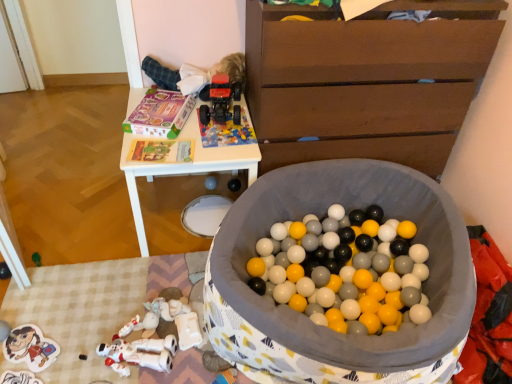
Image resolution: width=512 pixels, height=384 pixels. What do you see at coordinates (326, 327) in the screenshot?
I see `soft fabric ball pit at center, which is the sixth toy in left-to-right order` at bounding box center [326, 327].

At what (x,y) coordinates should I click in order to perform the action: click on white matte plastic robot at lower left, which is the 2th toy from left to right. Please return your answer as a coordinate pair (x, y). This screenshot has height=384, width=512. Looking at the image, I should click on (150, 338).

The width and height of the screenshot is (512, 384). I want to click on matte plastic speaker at center, positioned as the fourth toy in right-to-left order, so click(210, 183).

Measure the distance between point [42,338] and camera.

The distance of point [42,338] from camera is 1.48 meters.

What do you see at coordinates (185, 167) in the screenshot? The height and width of the screenshot is (384, 512). I see `white plastic table at upper center` at bounding box center [185, 167].

This screenshot has width=512, height=384. Describe the element at coordinates (161, 74) in the screenshot. I see `fluffy white baby at upper center` at that location.

Locate an element on the screen. This screenshot has width=512, height=384. soft fabric ball pit at center, acting as the first toy starting from the right is located at coordinates (326, 327).

Is soft fabric ball pit at center, which is the sixth toy in left-to-right order, oriented towards rubberized red toy truck at upper center, which appears as the third toy when viewed from the right?

No, soft fabric ball pit at center, which is the sixth toy in left-to-right order, is not oriented towards rubberized red toy truck at upper center, which appears as the third toy when viewed from the right.

Which is correct: soft fabric ball pit at center, which is the sixth toy in left-to-right order, is inside rubberized red toy truck at upper center, which appears as the third toy when viewed from the right, or outside of it?

The correct answer is: outside.

Is soft fabric ball pit at center, acting as the first toy starting from the right, shorter than rubberized red toy truck at upper center, which is the 4th toy from left to right?

No, soft fabric ball pit at center, acting as the first toy starting from the right, is not shorter than rubberized red toy truck at upper center, which is the 4th toy from left to right.

Is soft fabric ball pit at center, which is the sixth toy in left-to-right order, behind fluffy white baby at upper center?

No.

At what (x,y) coordinates should I click in order to perform the action: click on baby behind the soft fabric ball pit at center, acting as the first toy starting from the right. Please return your answer as a coordinate pair (x, y). The image size is (512, 384). Looking at the image, I should click on (161, 74).

Which of these two, soft fabric ball pit at center, which is the sixth toy in left-to-right order, or fluffy white baby at upper center, is bigger?

Bigger between the two is soft fabric ball pit at center, which is the sixth toy in left-to-right order.

Could you measure the distance between soft fabric ball pit at center, acting as the first toy starting from the right, and fluffy white baby at upper center?

soft fabric ball pit at center, acting as the first toy starting from the right, and fluffy white baby at upper center are 85.79 centimeters apart from each other.

Between brown wooden chest of drawers at upper right and soft fabric ball pit at center, which is the sixth toy in left-to-right order, which one has smaller size?

With smaller size is soft fabric ball pit at center, which is the sixth toy in left-to-right order.

Is point (336, 83) farther from camera compared to point (286, 185)?

No, (336, 83) is closer to viewer.

Is brown wooden chest of drawers at upper right to the left or to the right of soft fabric ball pit at center, which is the sixth toy in left-to-right order, in the image?

In the image, brown wooden chest of drawers at upper right appears on the right side of soft fabric ball pit at center, which is the sixth toy in left-to-right order.

Locate an element on the screen. The image size is (512, 384). chest of drawers above the soft fabric ball pit at center, acting as the first toy starting from the right (from the image's perspective) is located at coordinates (x=365, y=82).

Is matte black speaker at center, the second toy in the right-to-left sequence, facing away from fluffy white baby at upper center?

matte black speaker at center, the second toy in the right-to-left sequence, is not turned away from fluffy white baby at upper center.

From a real-world perspective, is matte black speaker at center, acting as the 5th toy starting from the left, positioned above or below fluffy white baby at upper center?

matte black speaker at center, acting as the 5th toy starting from the left, is situated lower than fluffy white baby at upper center in the real world.

In the scene shown: Considering the relative sizes of matte black speaker at center, the second toy in the right-to-left sequence, and fluffy white baby at upper center in the image provided, is matte black speaker at center, the second toy in the right-to-left sequence, thinner than fluffy white baby at upper center?

Correct, the width of matte black speaker at center, the second toy in the right-to-left sequence, is less than that of fluffy white baby at upper center.

Which point is more forward, (228, 182) or (223, 61)?

The point (223, 61) is closer to the camera.

Is soft fabric ball pit at center, acting as the first toy starting from the right, surrounded by rubberized red toy truck at upper center, which appears as the third toy when viewed from the right?

No, soft fabric ball pit at center, acting as the first toy starting from the right, is not a part of rubberized red toy truck at upper center, which appears as the third toy when viewed from the right.

Is rubberized red toy truck at upper center, which is the 4th toy from left to right, closer to the viewer compared to soft fabric ball pit at center, which is the sixth toy in left-to-right order?

No, it is behind soft fabric ball pit at center, which is the sixth toy in left-to-right order.

Which point is more forward, (234, 94) or (253, 225)?

The point (253, 225) is more forward.

Which is more to the left, rubberized red toy truck at upper center, which appears as the third toy when viewed from the right, or soft fabric ball pit at center, which is the sixth toy in left-to-right order?

From the viewer's perspective, rubberized red toy truck at upper center, which appears as the third toy when viewed from the right, appears more on the left side.

Looking at this image, between white matte plastic robot at lower left, which is the 2th toy from left to right, and matte plastic sticker at lower left, which ranks as the 6th toy in right-to-left order, which one appears on the right side from the viewer's perspective?

white matte plastic robot at lower left, which is the 2th toy from left to right.

Is white matte plastic robot at lower left, which is the 2th toy from left to right, oriented away from matte plastic sticker at lower left, which ranks as the 6th toy in right-to-left order?

Yes, white matte plastic robot at lower left, which is the 2th toy from left to right, is positioned with its back facing matte plastic sticker at lower left, which ranks as the 6th toy in right-to-left order.

Is the surface of white matte plastic robot at lower left, the fifth toy viewed from the right, in direct contact with matte plastic sticker at lower left, which is counted as the 1th toy, starting from the left?

white matte plastic robot at lower left, the fifth toy viewed from the right, is not next to matte plastic sticker at lower left, which is counted as the 1th toy, starting from the left, and they're not touching.

What's the angular difference between fluffy white baby at upper center and matte plastic sticker at lower left, which is counted as the 1th toy, starting from the left,'s facing directions?

The angular difference between fluffy white baby at upper center and matte plastic sticker at lower left, which is counted as the 1th toy, starting from the left, is 124 degrees.

How distant is fluffy white baby at upper center from matte plastic sticker at lower left, which ranks as the 6th toy in right-to-left order?

fluffy white baby at upper center is 3.75 feet away from matte plastic sticker at lower left, which ranks as the 6th toy in right-to-left order.

From a real-world perspective, which is physically below, fluffy white baby at upper center or matte plastic sticker at lower left, which is counted as the 1th toy, starting from the left?

In real-world perspective, matte plastic sticker at lower left, which is counted as the 1th toy, starting from the left, is lower.

Between fluffy white baby at upper center and matte plastic sticker at lower left, which is counted as the 1th toy, starting from the left, which one has larger width?

Wider between the two is matte plastic sticker at lower left, which is counted as the 1th toy, starting from the left.

This screenshot has height=384, width=512. What are the coordinates of `the 3rd toy below the rubberized red toy truck at upper center, which is the 4th toy from left to right (from the image's perspective)` in the screenshot? It's located at (326, 327).

Identify the location of toy that is the 4th object located in front of the fluffy white baby at upper center. (326, 327).

Which object lies nearer to the anchor point white matte plastic robot at lower left, the fifth toy viewed from the right, matte black speaker at center, acting as the 5th toy starting from the left, or brown wooden chest of drawers at upper right?

Among the two, matte black speaker at center, acting as the 5th toy starting from the left, is located nearer to white matte plastic robot at lower left, the fifth toy viewed from the right.

Considering their positions, is soft fabric ball pit at center, which is the sixth toy in left-to-right order, positioned further to matte plastic sticker at lower left, which is counted as the 1th toy, starting from the left, than rubberized red toy truck at upper center, which is the 4th toy from left to right?

Based on the image, rubberized red toy truck at upper center, which is the 4th toy from left to right, appears to be further to matte plastic sticker at lower left, which is counted as the 1th toy, starting from the left.

Based on their spatial positions, is soft fabric ball pit at center, which is the sixth toy in left-to-right order, or rubberized red toy truck at upper center, which is the 4th toy from left to right, closer to white plastic table at upper center?

The object closer to white plastic table at upper center is rubberized red toy truck at upper center, which is the 4th toy from left to right.

Considering their positions, is white matte plastic robot at lower left, which is the 2th toy from left to right, positioned further to matte plastic sticker at lower left, which ranks as the 6th toy in right-to-left order, than brown wooden chest of drawers at upper right?

Based on the image, brown wooden chest of drawers at upper right appears to be further to matte plastic sticker at lower left, which ranks as the 6th toy in right-to-left order.

From the picture: Which object lies further to the anchor point white matte plastic robot at lower left, the fifth toy viewed from the right, matte plastic speaker at center, placed as the third toy when sorted from left to right, or white plastic table at upper center?

matte plastic speaker at center, placed as the third toy when sorted from left to right, lies further to white matte plastic robot at lower left, the fifth toy viewed from the right, than the other object.

In the scene shown: When comparing their distances from brown wooden chest of drawers at upper right, does soft fabric ball pit at center, acting as the first toy starting from the right, or white plastic table at upper center seem further?

Based on the image, white plastic table at upper center appears to be further to brown wooden chest of drawers at upper right.

When comparing their distances from rubberized red toy truck at upper center, which appears as the third toy when viewed from the right, does matte plastic sticker at lower left, which is counted as the 1th toy, starting from the left, or soft fabric ball pit at center, acting as the first toy starting from the right, seem further?

matte plastic sticker at lower left, which is counted as the 1th toy, starting from the left, is further to rubberized red toy truck at upper center, which appears as the third toy when viewed from the right.

Based on their spatial positions, is white matte plastic robot at lower left, the fifth toy viewed from the right, or white plastic table at upper center closer to matte black speaker at center, acting as the 5th toy starting from the left?

The object closer to matte black speaker at center, acting as the 5th toy starting from the left, is white plastic table at upper center.

Identify the location of baby between soft fabric ball pit at center, acting as the first toy starting from the right, and matte black speaker at center, the second toy in the right-to-left sequence, in the front-back direction. (161, 74).

Where is `table between soft fabric ball pit at center, which is the sixth toy in left-to-right order, and matte black speaker at center, acting as the 5th toy starting from the left, from front to back`? This screenshot has width=512, height=384. table between soft fabric ball pit at center, which is the sixth toy in left-to-right order, and matte black speaker at center, acting as the 5th toy starting from the left, from front to back is located at coordinates (185, 167).

This screenshot has height=384, width=512. In order to click on baby between matte plastic sticker at lower left, which is counted as the 1th toy, starting from the left, and brown wooden chest of drawers at upper right, in the horizontal direction in this screenshot , I will do `click(161, 74)`.

The width and height of the screenshot is (512, 384). What are the coordinates of `table located between soft fabric ball pit at center, which is the sixth toy in left-to-right order, and rubberized red toy truck at upper center, which appears as the third toy when viewed from the right, in the depth direction` in the screenshot? It's located at (185, 167).